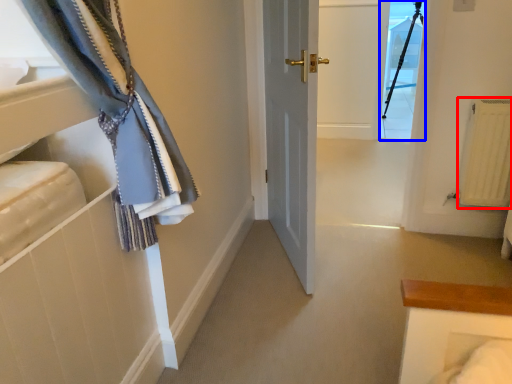
Question: Among these objects, which one is nearest to the camera, radiator (highlighted by a red box) or glass door (highlighted by a blue box)?

Choices:
 (A) radiator
 (B) glass door

Answer: (A)